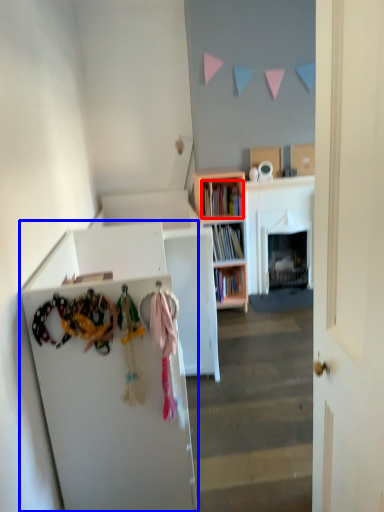
Question: Which object is further to the camera taking this photo, book (highlighted by a red box) or cabinetry (highlighted by a blue box)?

Choices:
 (A) book
 (B) cabinetry

Answer: (A)